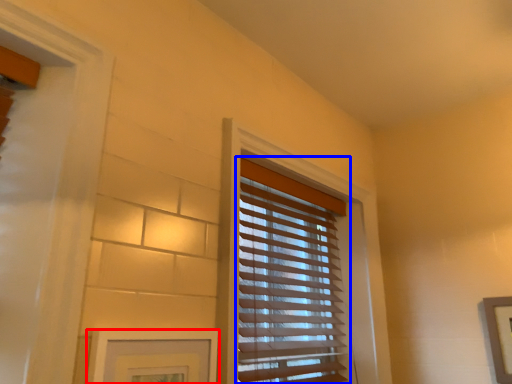
Question: Which point is closer to the camera, picture frame (highlighted by a red box) or window blind (highlighted by a blue box)?

Choices:
 (A) picture frame
 (B) window blind

Answer: (A)